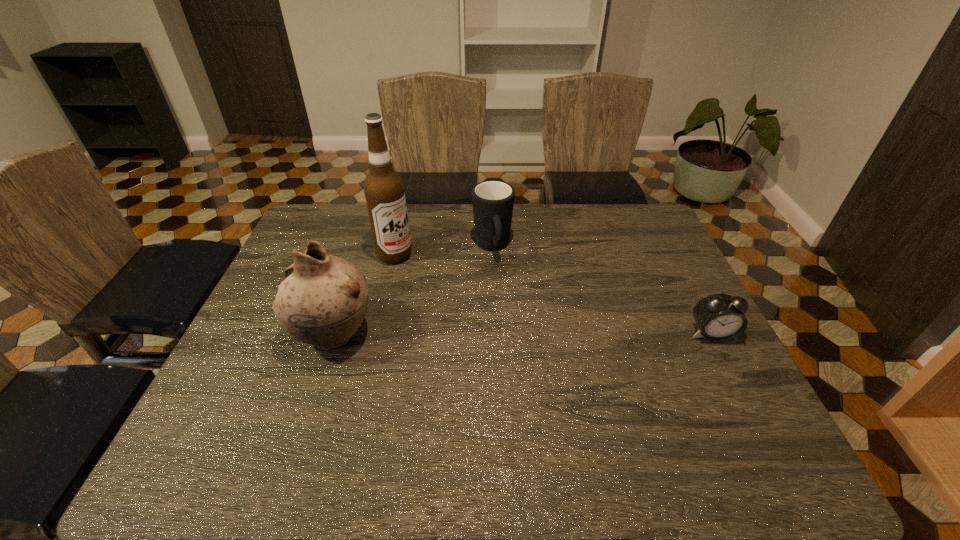
The height and width of the screenshot is (540, 960). Find the location of `vacant space on the desktop that is between the third shortest object and the alarm clock and is positioned on the label of the alcohol`. vacant space on the desktop that is between the third shortest object and the alarm clock and is positioned on the label of the alcohol is located at coordinates (538, 334).

At what (x,y) coordinates should I click in order to perform the action: click on vacant space on the desktop that is between the pottery and the alarm clock and is positioned on the side of the mug with the handle. Please return your answer as a coordinate pair (x, y). Looking at the image, I should click on (515, 334).